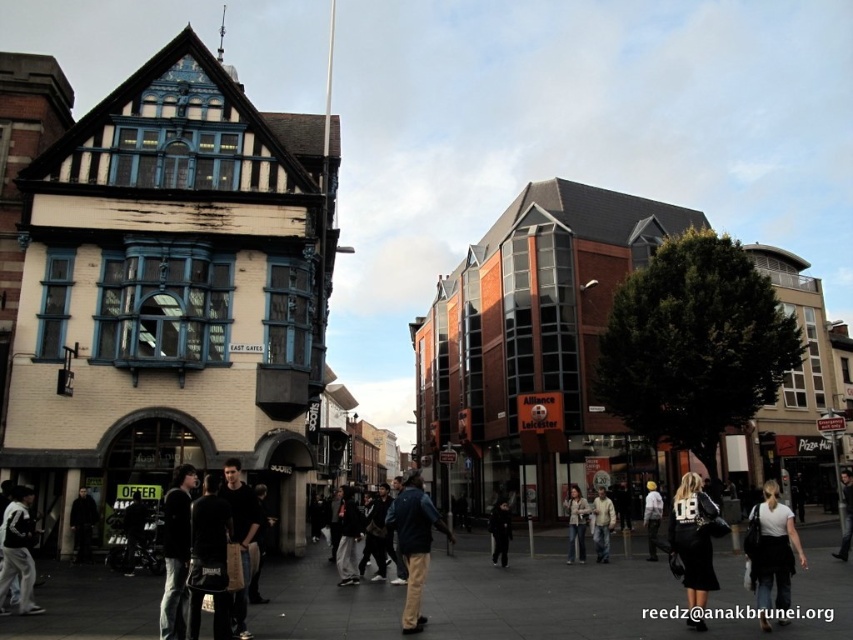
Question: In this image, where is dark blue jacket at lower left located relative to light brown leather jacket at center?

Choices:
 (A) above
 (B) below

Answer: (A)

Question: Is white matte shirt at center below denim jacket at center?

Choices:
 (A) yes
 (B) no

Answer: (B)

Question: Which of the following is the closest to the observer?

Choices:
 (A) (648, 486)
 (B) (71, 531)
 (C) (410, 497)

Answer: (C)

Question: Among these points, which one is farthest from the camera?

Choices:
 (A) (498, 541)
 (B) (712, 508)
 (C) (76, 536)

Answer: (A)

Question: Which object is farther from the camera taking this photo?

Choices:
 (A) black matte jacket at lower left
 (B) light brown leather jacket at center
 (C) white cotton jacket at lower left

Answer: (B)

Question: Can you confirm if denim jacket at center is positioned to the left of black matte jacket at center?

Choices:
 (A) no
 (B) yes

Answer: (A)